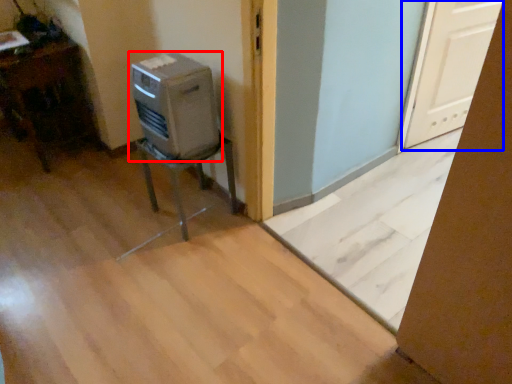
Question: Which point is further to the camera, home appliance (highlighted by a red box) or screen door (highlighted by a blue box)?

Choices:
 (A) home appliance
 (B) screen door

Answer: (B)